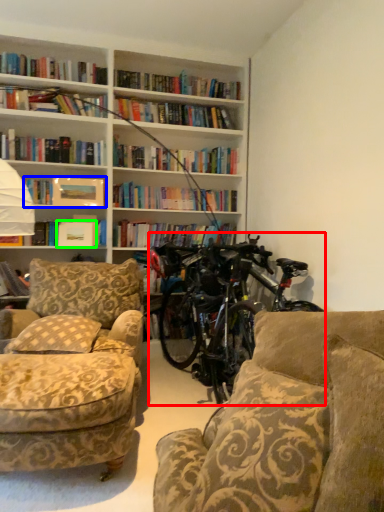
Question: Considering the real-world distances, which object is closest to bicycle (highlighted by a red box)? book (highlighted by a blue box) or paperback book (highlighted by a green box).

Choices:
 (A) book
 (B) paperback book

Answer: (B)